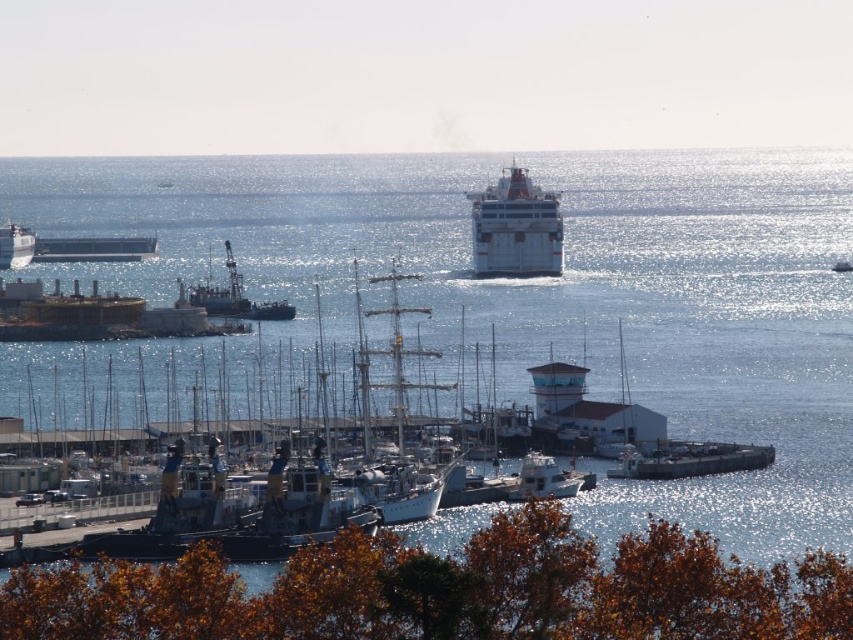
Between metallic gray barge at center and white matte ship at left, which one appears on the right side from the viewer's perspective?

From the viewer's perspective, metallic gray barge at center appears more on the right side.

Who is more forward, (740, 458) or (33, 241)?

Positioned in front is point (740, 458).

I want to click on metallic gray barge at center, so click(x=689, y=460).

At what (x,y) coordinates should I click in order to perform the action: click on metallic gray ship at center. Please return your answer as a coordinate pair (x, y). This screenshot has height=640, width=853. Looking at the image, I should click on (235, 298).

Between metallic gray ship at center and white matte ship at left, which one has less height?

With less height is white matte ship at left.

What do you see at coordinates (235, 298) in the screenshot? I see `metallic gray ship at center` at bounding box center [235, 298].

Where is `metallic gray ship at center`? The height and width of the screenshot is (640, 853). metallic gray ship at center is located at coordinates (235, 298).

Can you confirm if white matte cruise ship at center is bigger than metallic gray barge at center?

Yes, white matte cruise ship at center is bigger than metallic gray barge at center.

Which is behind, point (512, 232) or point (676, 445)?

The point (512, 232) is more distant.

Image resolution: width=853 pixels, height=640 pixels. What are the coordinates of `white matte cruise ship at center` in the screenshot? It's located at (515, 227).